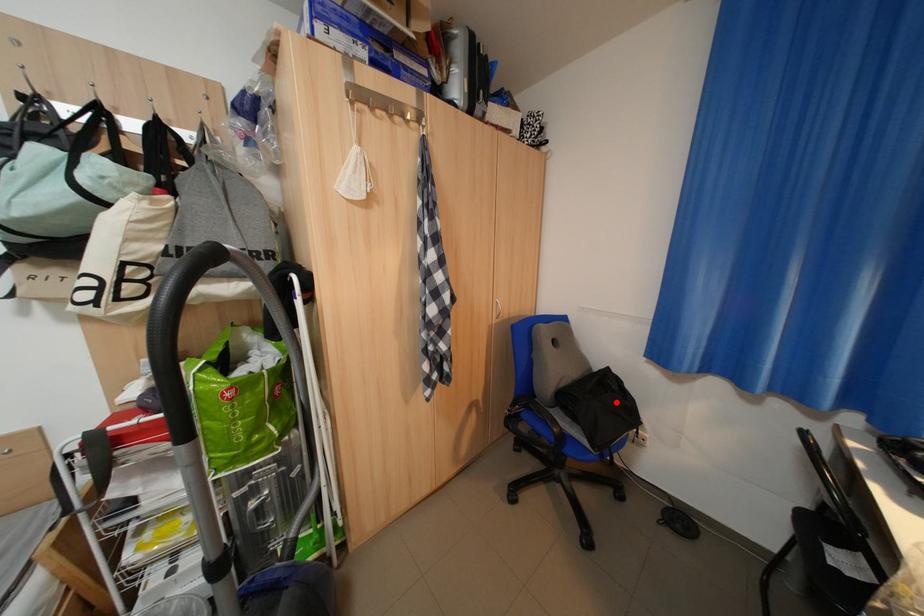
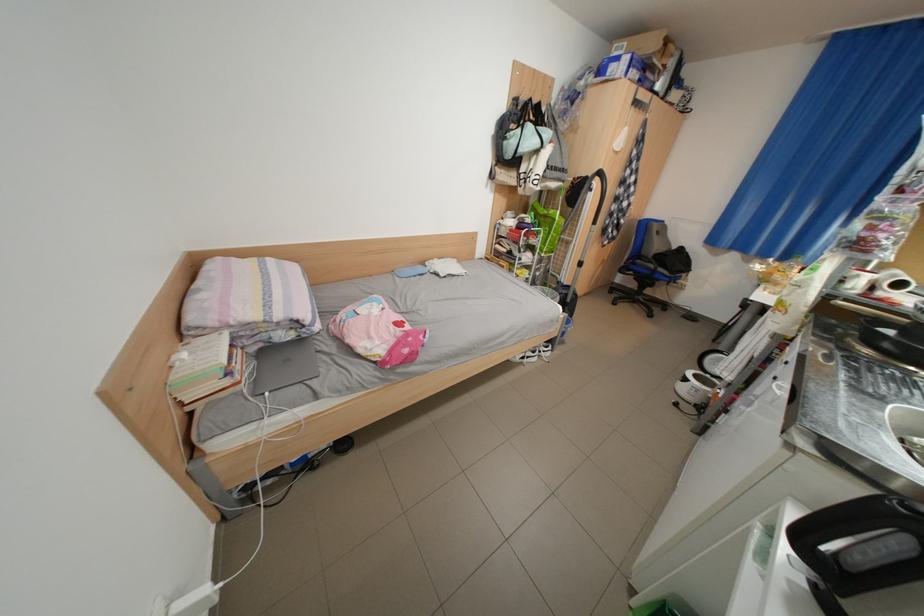
In the second image, find the point that corresponds to the highlighted location in the first image.

(687, 264)